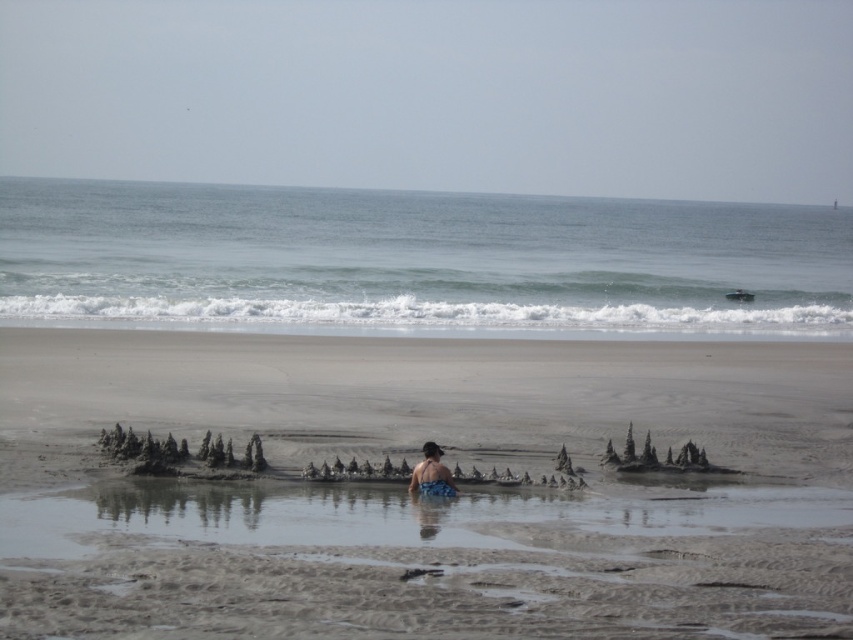
Question: Which object is positioned closest to the blue textured swimsuit at center?

Choices:
 (A) sandy beach at center
 (B) blue water at center

Answer: (A)

Question: From the image, what is the correct spatial relationship of sandy beach at center in relation to blue textured swimsuit at center?

Choices:
 (A) above
 (B) below

Answer: (A)

Question: Which point is farther to the camera?

Choices:
 (A) sandy beach at center
 (B) blue textured swimsuit at center
 (C) blue water at center

Answer: (C)

Question: Among these objects, which one is farthest from the camera?

Choices:
 (A) blue textured swimsuit at center
 (B) blue water at center

Answer: (B)

Question: Is blue water at center further to the viewer compared to blue textured swimsuit at center?

Choices:
 (A) no
 (B) yes

Answer: (B)

Question: Can you confirm if sandy beach at center is wider than blue textured swimsuit at center?

Choices:
 (A) no
 (B) yes

Answer: (B)